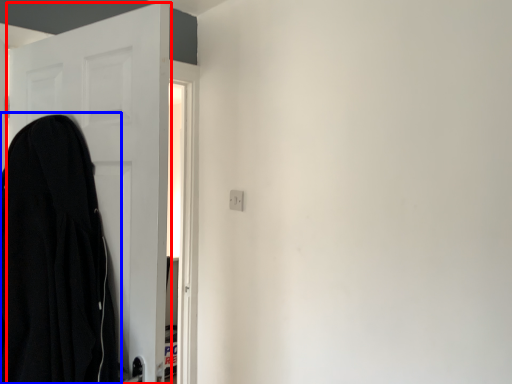
Question: Which object appears farthest to the camera in this image, door (highlighted by a red box) or cloak (highlighted by a blue box)?

Choices:
 (A) door
 (B) cloak

Answer: (A)